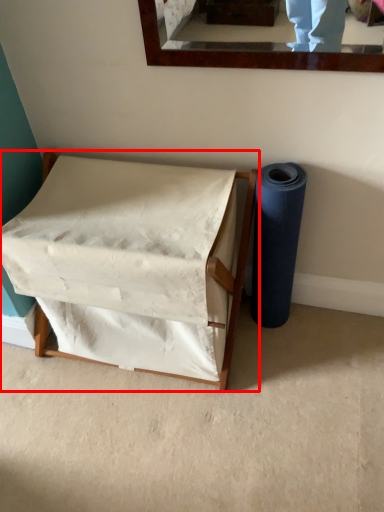
Question: Considering the relative positions of furniture (annotated by the red box) and toilet paper in the image provided, where is furniture (annotated by the red box) located with respect to the staircase?

Choices:
 (A) right
 (B) left

Answer: (B)